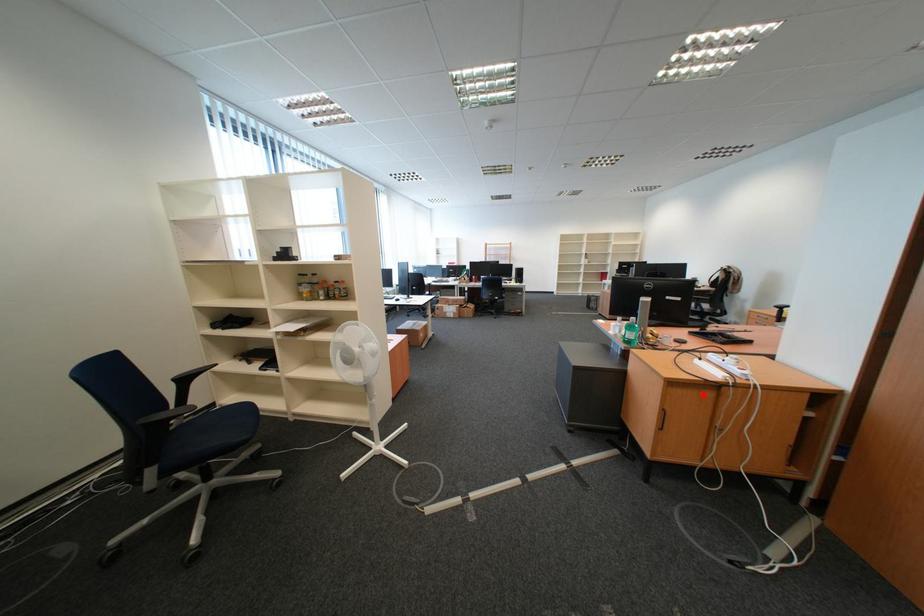
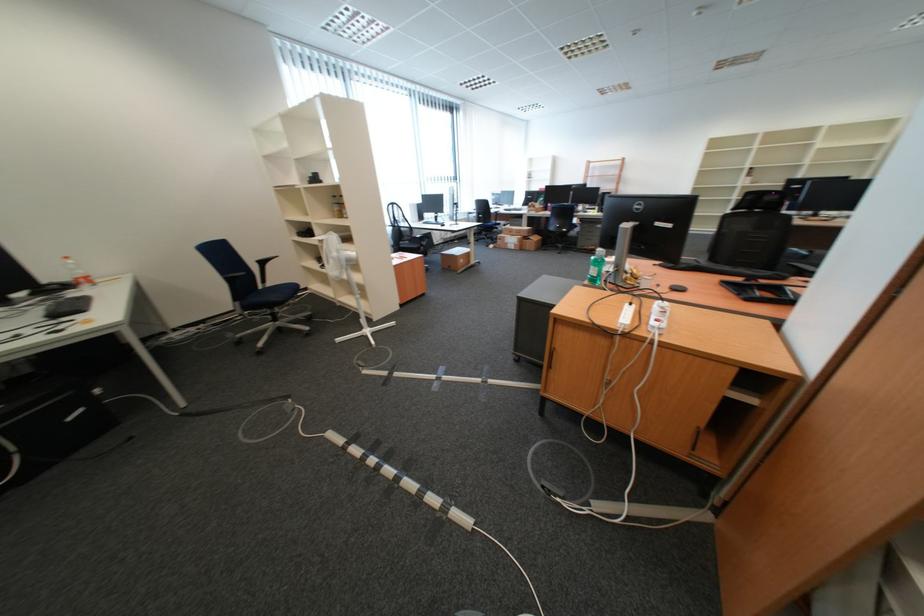
Find the pixel in the second image that matches the highlighted location in the first image.

(594, 338)